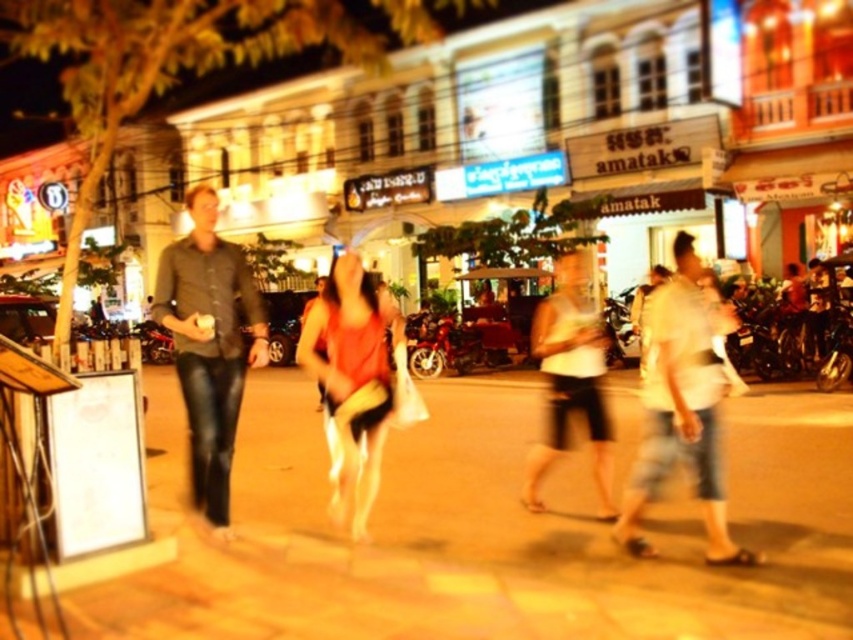
You are a photographer trying to capture a candid shot of the two people wearing the matte black shirt at left and the white cotton shirt at center. The camera can only focus on one person at a time. If you want to ensure the subject fills the frame, which person should you choose?

The matte black shirt at left might be wider than the white cotton shirt at center, so focusing on the matte black shirt at left would likely fill the frame better.

You are a photographer standing on the sidewalk in the image. You notice the brown stone pavement at center and the white cotton shirt at center. Which object is positioned higher in your field of view?

The brown stone pavement at center is taller than the white cotton shirt at center, so it is positioned higher in your field of view.

You are a photographer standing on the sidewalk and see the matte black shirt at left and the white cotton shirt at center. Which person is closer to the left side of the sidewalk?

The matte black shirt at left is closer to the left side of the sidewalk than the white cotton shirt at center.